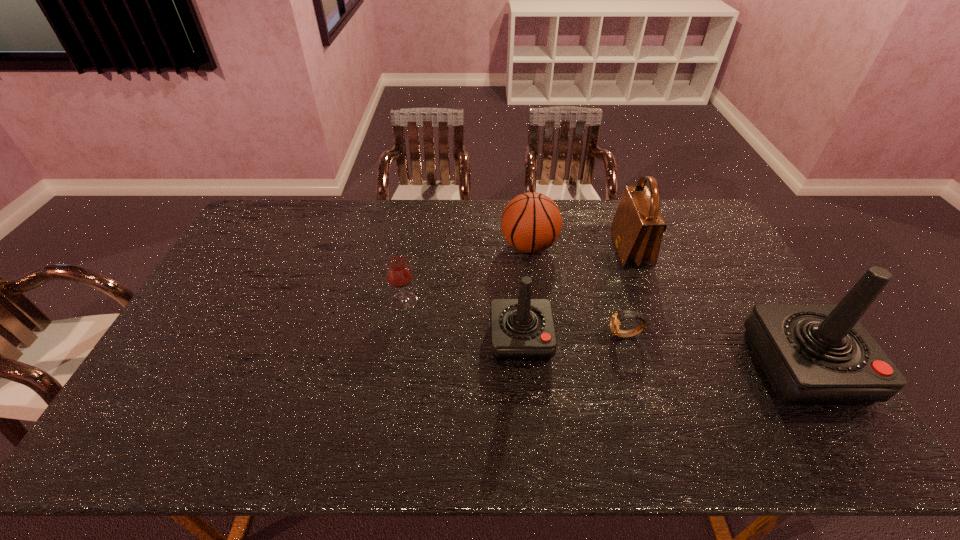
Find the location of a particular element. the shorter joystick is located at coordinates (522, 329).

Find the location of a particular element. This screenshot has width=960, height=540. the rightmost object is located at coordinates coord(812,354).

Where is `the right joystick`? This screenshot has width=960, height=540. the right joystick is located at coordinates (812, 354).

This screenshot has height=540, width=960. I want to click on shoulder bag, so click(637, 229).

You are a GUI agent. You are given a task and a screenshot of the screen. Output one action in this format:
    pyautogui.click(x=<x>, y=<y>)
    Task: Click on the second tallest object
    
    Given the screenshot: What is the action you would take?
    pyautogui.click(x=637, y=229)

Locate an element on the screen. This screenshot has height=540, width=960. basketball is located at coordinates (531, 222).

You are a GUI agent. You are given a task and a screenshot of the screen. Output one action in this format:
    pyautogui.click(x=<x>, y=<y>)
    Task: Click on the second shortest object
    
    Given the screenshot: What is the action you would take?
    pyautogui.click(x=399, y=273)

Find the location of a particular element. Image resolution: width=960 pixels, height=540 pixels. the leftmost object is located at coordinates (399, 273).

I want to click on watch, so click(616, 318).

Where is `the shortest object`? the shortest object is located at coordinates (616, 318).